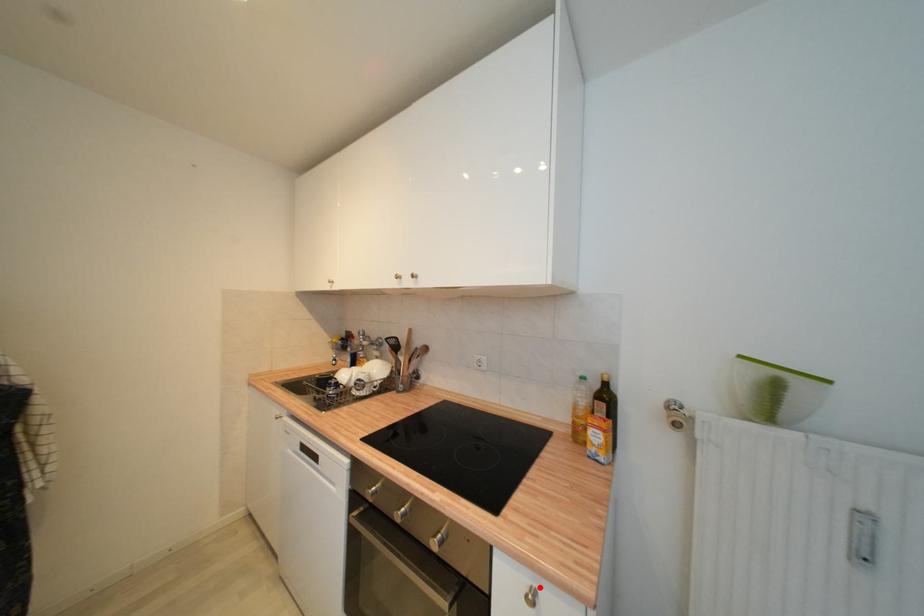
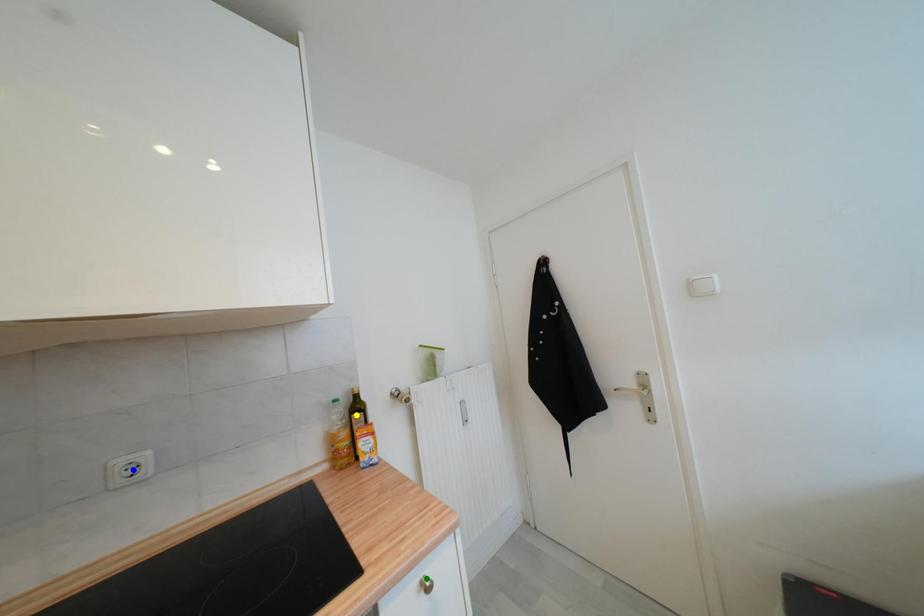
Question: I am providing you with two images of the same scene from different viewpoints. A red point is marked on the first image. You are given multiple points on the second image. Which spot in image 2 lines up with the point in image 1?

Choices:
 (A) yellow point
 (B) green point
 (C) blue point

Answer: (B)